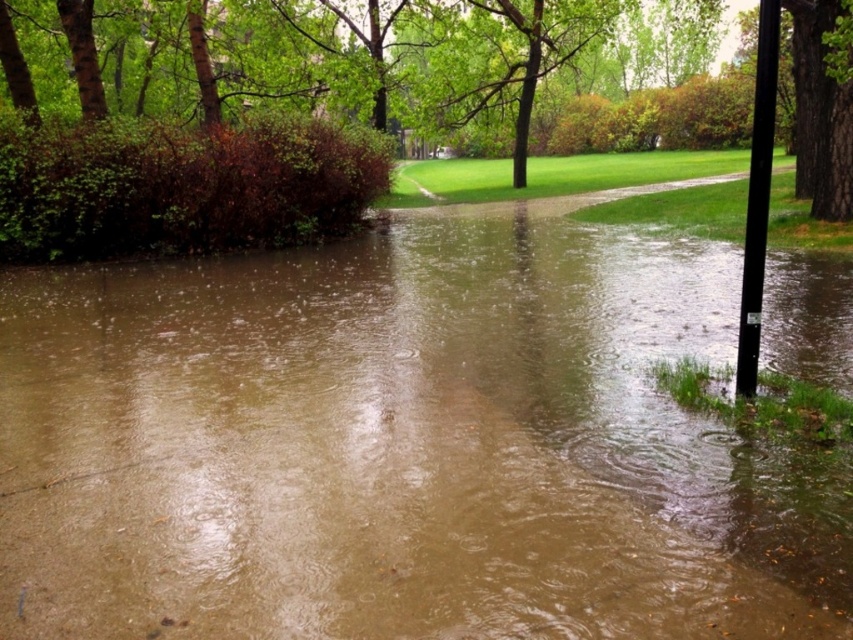
Is point (299, 342) positioned before point (817, 65)?

That is True.

Which is behind, point (637, 401) or point (799, 58)?

Point (799, 58)

The width and height of the screenshot is (853, 640). I want to click on brown muddy water at center, so click(378, 444).

Between point (825, 140) and point (769, 189), which one is positioned in front?

Positioned in front is point (769, 189).

This screenshot has height=640, width=853. I want to click on brown rough bark tree at upper right, so click(820, 113).

Where is `brown rough bark tree at upper right`? Image resolution: width=853 pixels, height=640 pixels. brown rough bark tree at upper right is located at coordinates (820, 113).

Is point (91, 307) closer to viewer compared to point (744, 228)?

Yes.

Which is behind, point (189, 516) or point (770, 72)?

The point (770, 72) is more distant.

Is point (399, 582) in front of point (741, 298)?

Yes.

Find the location of `brown muddy water at center`. brown muddy water at center is located at coordinates (378, 444).